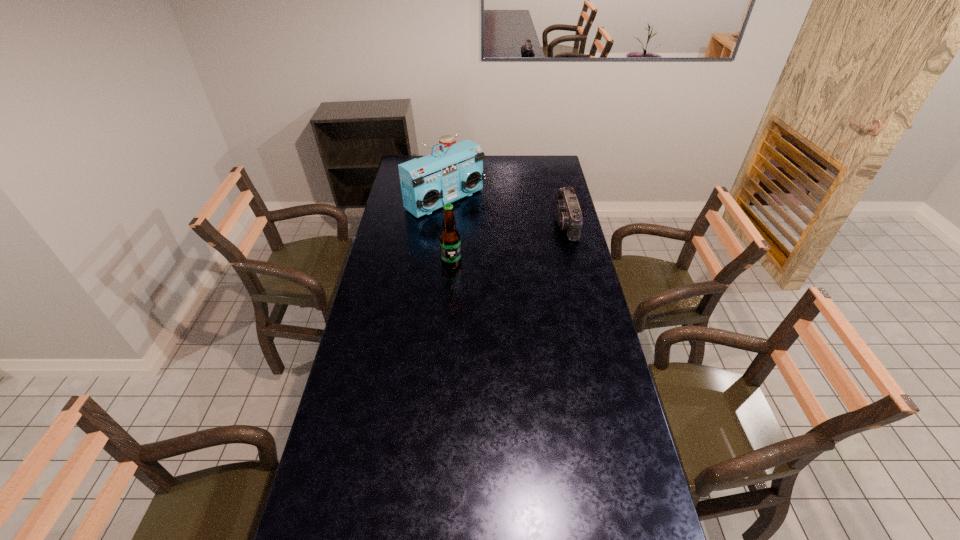
The width and height of the screenshot is (960, 540). Identify the location of vacant space situated 0.170m on the front-facing side of the radio receiver. (493, 233).

I want to click on free spot located 0.160m on the front-facing side of the radio receiver, so click(x=492, y=232).

Find the location of a particular element. This screenshot has height=540, width=960. vacant space located on the front label of the can is located at coordinates (476, 199).

Find the location of a particular element. This screenshot has width=960, height=540. vacant region located 0.370m on the front label of the can is located at coordinates (476, 199).

Where is `vacant position located 0.260m on the front label of the can`? This screenshot has height=540, width=960. vacant position located 0.260m on the front label of the can is located at coordinates (468, 188).

What are the coordinates of `object situated at the far edge` in the screenshot? It's located at (446, 140).

What are the coordinates of `object at the left edge` in the screenshot? It's located at (428, 183).

The width and height of the screenshot is (960, 540). I want to click on object located in the right edge section of the desktop, so click(569, 217).

Where is `free space at the far edge`? free space at the far edge is located at coordinates (511, 171).

Identify the location of free location at the left edge. (401, 228).